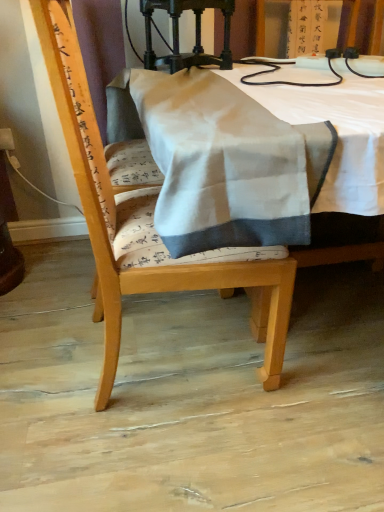
I want to click on wooden chair at center, so click(x=146, y=222).

Describe the element at coordinates (341, 167) in the screenshot. This screenshot has width=384, height=512. I see `white fabric at center` at that location.

Where is `polished dark wood lamp at upper center`? polished dark wood lamp at upper center is located at coordinates (195, 38).

Where is `wooden chair at center`? wooden chair at center is located at coordinates (146, 222).

Is point (120, 281) closer to viewer compared to point (366, 164)?

No, it is not.

Find the location of a particular element. The height and width of the screenshot is (512, 384). chair located above the white fabric at center (from a real-world perspective) is located at coordinates (146, 222).

Considering the positions of objects wooden chair at center and white fabric at center in the image provided, who is in front, wooden chair at center or white fabric at center?

white fabric at center is more forward.

How much distance is there between white fabric at center and polished dark wood lamp at upper center?

A distance of 13.00 inches exists between white fabric at center and polished dark wood lamp at upper center.

Looking at this image, from the image's perspective, which one is positioned lower, white fabric at center or polished dark wood lamp at upper center?

From the image's view, white fabric at center is below.

Is white fabric at center facing towards polished dark wood lamp at upper center?

No, white fabric at center is not facing towards polished dark wood lamp at upper center.

Is the surface of white fabric at center in direct contact with polished dark wood lamp at upper center?

white fabric at center and polished dark wood lamp at upper center are clearly separated.

Between white fabric at center and wooden chair at center, which one has smaller width?

wooden chair at center is thinner.

Is white fabric at center shorter than wooden chair at center?

Yes, white fabric at center is shorter than wooden chair at center.

Which object is more forward, white fabric at center or wooden chair at center?

Positioned in front is white fabric at center.

Which object is further away from the camera, polished dark wood lamp at upper center or wooden chair at center?

polished dark wood lamp at upper center is further away from the camera.

Consider the image. Which object is positioned more to the left, polished dark wood lamp at upper center or wooden chair at center?

wooden chair at center.

Considering the relative sizes of polished dark wood lamp at upper center and wooden chair at center in the image provided, is polished dark wood lamp at upper center shorter than wooden chair at center?

Yes.

Is the surface of polished dark wood lamp at upper center in direct contact with white fabric at center?

No, polished dark wood lamp at upper center is not beside white fabric at center.

From a real-world perspective, which object stands above the other?

polished dark wood lamp at upper center is physically above.

Is polished dark wood lamp at upper center looking in the opposite direction of white fabric at center?

polished dark wood lamp at upper center is not turned away from white fabric at center.

Is wooden chair at center completely or partially outside of polished dark wood lamp at upper center?

wooden chair at center lies outside polished dark wood lamp at upper center's area.

Where is `chair that appears on the left of polished dark wood lamp at upper center`? The image size is (384, 512). chair that appears on the left of polished dark wood lamp at upper center is located at coordinates (146, 222).

Is wooden chair at center to the left of polished dark wood lamp at upper center from the viewer's perspective?

Yes.

Find the location of `table lying above the wooden chair at center (from the image's perspective)`. table lying above the wooden chair at center (from the image's perspective) is located at coordinates (341, 167).

The height and width of the screenshot is (512, 384). I want to click on table on the right of polished dark wood lamp at upper center, so click(x=341, y=167).

In the scene shown: Considering their positions, is wooden chair at center positioned further to polished dark wood lamp at upper center than white fabric at center?

wooden chair at center.

Considering their positions, is polished dark wood lamp at upper center positioned further to wooden chair at center than white fabric at center?

The object further to wooden chair at center is polished dark wood lamp at upper center.

When comparing their distances from wooden chair at center, does white fabric at center or polished dark wood lamp at upper center seem closer?

white fabric at center.

Looking at the image, which one is located closer to white fabric at center, wooden chair at center or polished dark wood lamp at upper center?

polished dark wood lamp at upper center is closer to white fabric at center.

Considering their positions, is white fabric at center positioned closer to polished dark wood lamp at upper center than wooden chair at center?

Based on the image, white fabric at center appears to be nearer to polished dark wood lamp at upper center.

Based on their spatial positions, is polished dark wood lamp at upper center or wooden chair at center further from white fabric at center?

Among the two, wooden chair at center is located further to white fabric at center.

Locate an element on the screen. Image resolution: width=384 pixels, height=512 pixels. table between polished dark wood lamp at upper center and wooden chair at center from top to bottom is located at coordinates (341, 167).